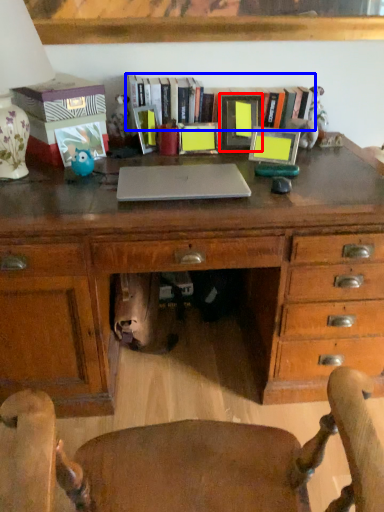
Question: Which of the following is the farthest to the observer, picture frame (highlighted by a red box) or book (highlighted by a blue box)?

Choices:
 (A) picture frame
 (B) book

Answer: (B)